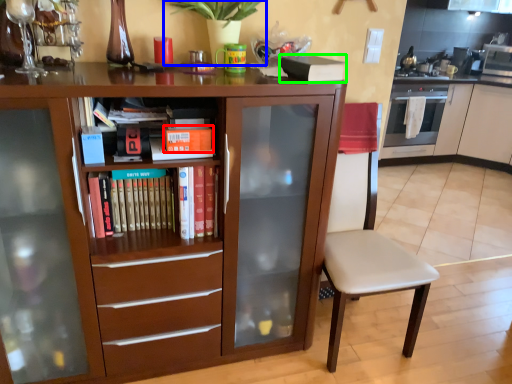
Question: Considering the real-world distances, which object is farthest from paperback book (highlighted by a red box)? plant (highlighted by a blue box) or paperback book (highlighted by a green box)?

Choices:
 (A) plant
 (B) paperback book

Answer: (B)